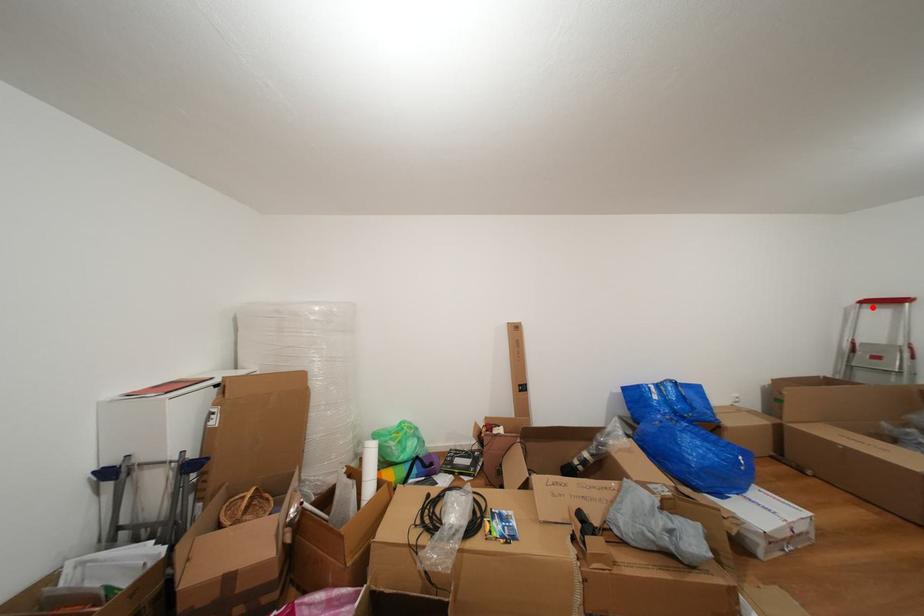
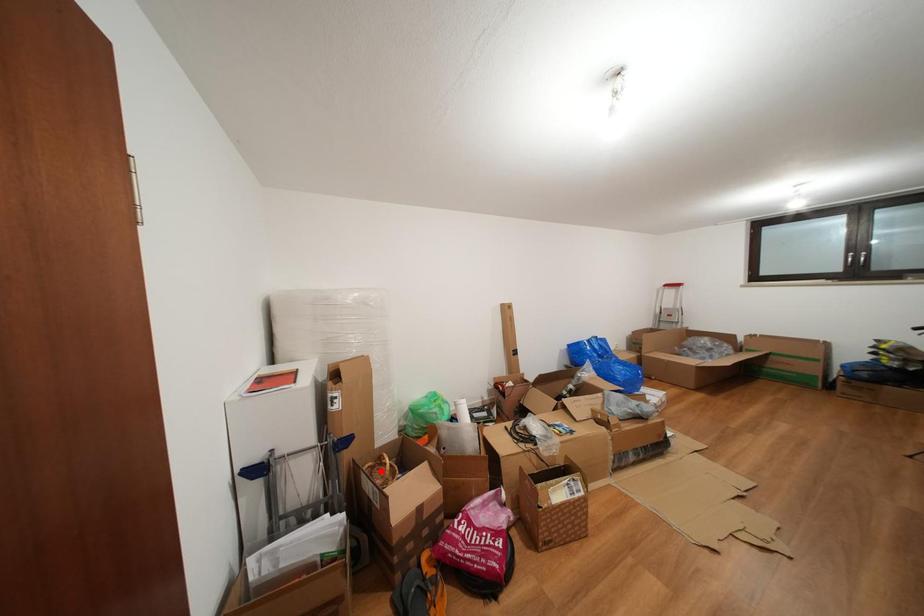
I am providing you with two images of the same scene from different viewpoints. A red point is marked on the first image and another point is marked on the second image. Do the highlighted points in image1 and image2 indicate the same real-world spot?

No